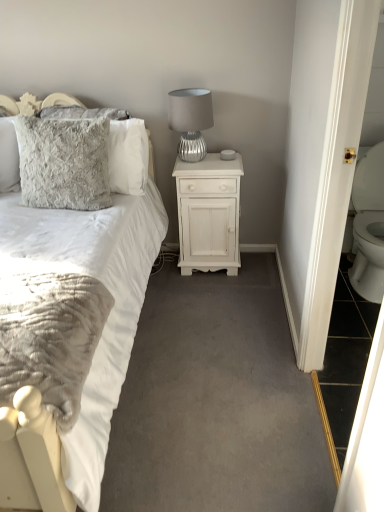
Find the location of a particular element. Image resolution: width=384 pixels, height=512 pixels. free location in front of white painted wood nightstand at center is located at coordinates (211, 295).